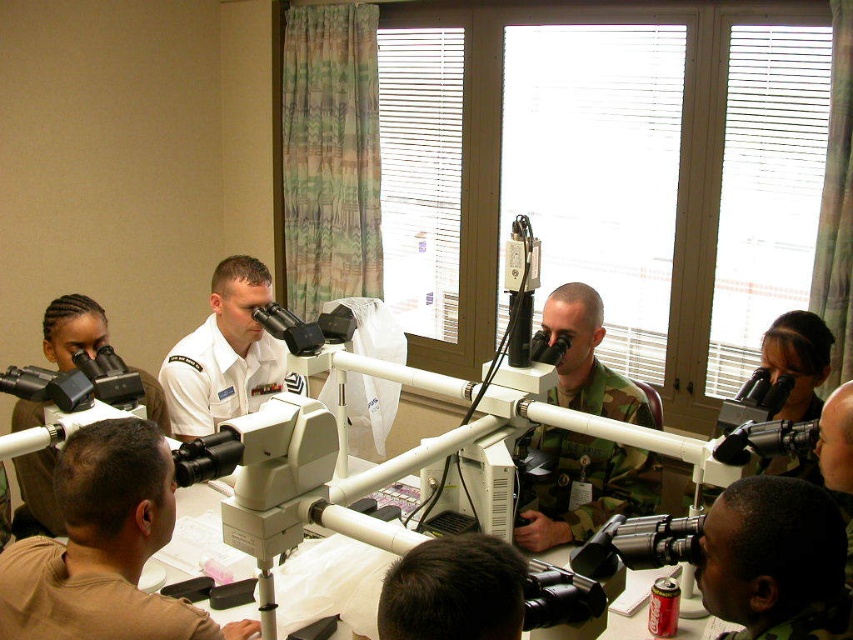
Can you confirm if brown matte uniform at center is positioned below white uniform at center?

Indeed, brown matte uniform at center is positioned under white uniform at center.

At what (x,y) coordinates should I click in order to perform the action: click on brown matte uniform at center. Please return your answer as a coordinate pair (x, y). The image size is (853, 640). Looking at the image, I should click on 103,547.

At what (x,y) coordinates should I click in order to perform the action: click on brown matte uniform at center. Please return your answer as a coordinate pair (x, y). This screenshot has height=640, width=853. Looking at the image, I should click on (103, 547).

Does camouflage uniform at center have a smaller size compared to white uniform at center?

Yes, camouflage uniform at center is smaller than white uniform at center.

Is camouflage uniform at center below white uniform at center?

Yes.

Which is in front, point (561, 518) or point (207, 392)?

Point (561, 518)

This screenshot has width=853, height=640. What are the coordinates of `camouflage uniform at center` in the screenshot? It's located at (581, 486).

Between point (177, 618) and point (521, 531), which one is positioned in front?

Point (177, 618)

Between brown matte uniform at center and camouflage uniform at center, which one appears on the left side from the viewer's perspective?

Positioned to the left is brown matte uniform at center.

Does point (125, 531) lie in front of point (532, 484)?

Yes, it is.

Find the location of a particular element. The height and width of the screenshot is (640, 853). brown matte uniform at center is located at coordinates (103, 547).